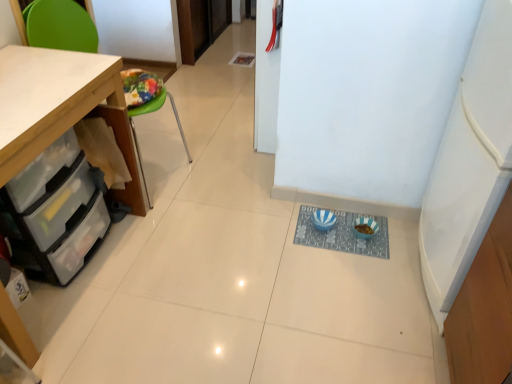
Question: From a real-world perspective, is clear plastic drawers at lower left physically located above or below blue striped bowls at center?

Choices:
 (A) below
 (B) above

Answer: (B)

Question: Is clear plastic drawers at lower left wider or thinner than blue striped bowls at center?

Choices:
 (A) wide
 (B) thin

Answer: (A)

Question: Which of these objects is positioned farthest from the green plastic chair at left?

Choices:
 (A) clear plastic drawers at lower left
 (B) wooden cabinet at left
 (C) blue striped bowls at center

Answer: (C)

Question: Which object is the farthest from the green plastic chair at left?

Choices:
 (A) clear plastic drawers at lower left
 (B) wooden cabinet at left
 (C) blue striped bowls at center

Answer: (C)